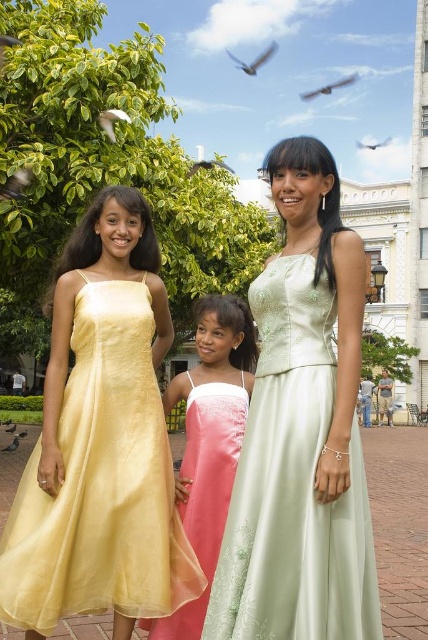
Is gray feathered bird at upper center above smooth feathered bird at upper center?

Correct, gray feathered bird at upper center is located above smooth feathered bird at upper center.

Where is `gray feathered bird at upper center`? gray feathered bird at upper center is located at coordinates (253, 60).

Is point (228, 51) behind point (357, 144)?

Yes, it is.

This screenshot has height=640, width=428. I want to click on gray feathered bird at upper center, so click(253, 60).

Which is in front, point (211, 532) or point (14, 426)?

Point (211, 532)

Is pink satin dress at center bigger than brown feathered bird at center?

Yes.

Identify the location of pink satin dress at center. Image resolution: width=428 pixels, height=640 pixels. (205, 488).

Identify the location of pink satin dress at center. The height and width of the screenshot is (640, 428). (205, 488).

Is pink satin dress at center thinner than white feathered bird at upper left?

Incorrect, pink satin dress at center's width is not less than white feathered bird at upper left's.

Can you confirm if pink satin dress at center is smaller than white feathered bird at upper left?

Incorrect, pink satin dress at center is not smaller in size than white feathered bird at upper left.

Is point (196, 458) closer to viewer compared to point (109, 134)?

Yes.

This screenshot has height=640, width=428. In order to click on pink satin dress at center in this screenshot , I will do `click(205, 488)`.